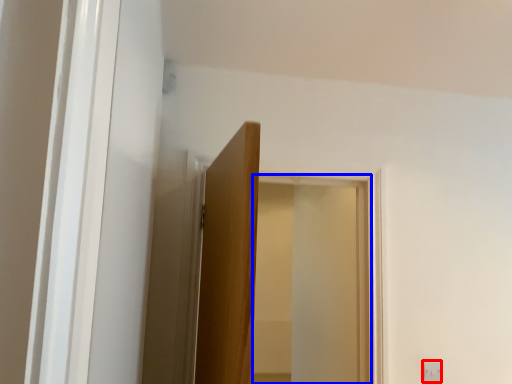
Question: Which point is closer to the camera, light switch (highlighted by a red box) or window (highlighted by a blue box)?

Choices:
 (A) light switch
 (B) window

Answer: (B)